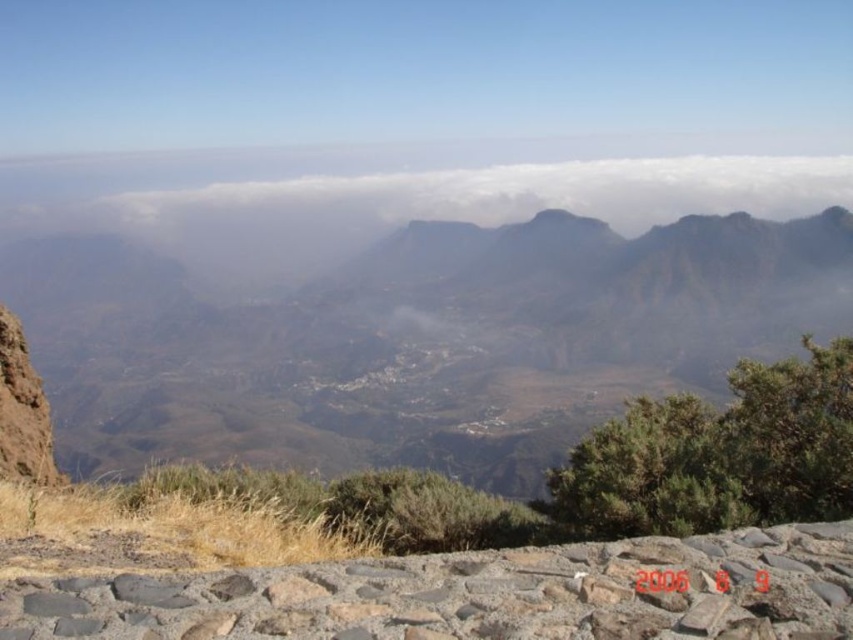
Is rugged rock mountain at center to the right of white fluffy cloud at center from the viewer's perspective?

In fact, rugged rock mountain at center is to the left of white fluffy cloud at center.

Is point (343, 461) positioned behind point (200, 182)?

No, it is not.

What do you see at coordinates (418, 340) in the screenshot? Image resolution: width=853 pixels, height=640 pixels. I see `rugged rock mountain at center` at bounding box center [418, 340].

Identify the location of rugged rock mountain at center. (418, 340).

Is rugged rock mountain at center below gray/rough stone at lower center?

Incorrect, rugged rock mountain at center is not positioned below gray/rough stone at lower center.

Between point (346, 282) and point (216, 608), which one is positioned in front?

Point (216, 608)

Locate an element on the screen. The width and height of the screenshot is (853, 640). rugged rock mountain at center is located at coordinates (418, 340).

Who is shorter, gray/rough stone at lower center or white fluffy cloud at center?

With less height is gray/rough stone at lower center.

Is gray/rough stone at lower center taller than white fluffy cloud at center?

No.

Locate an element on the screen. gray/rough stone at lower center is located at coordinates (477, 595).